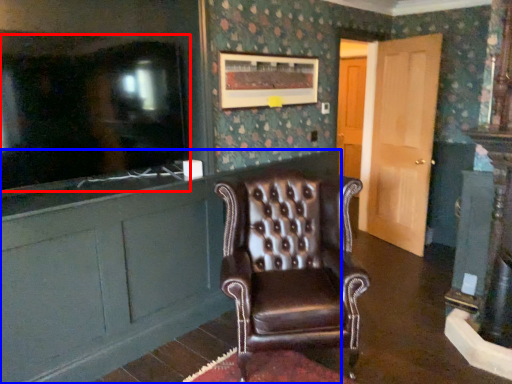
Question: Which object appears closest to the camera in this image, tv show (highlighted by a red box) or cabinetry (highlighted by a blue box)?

Choices:
 (A) tv show
 (B) cabinetry

Answer: (A)